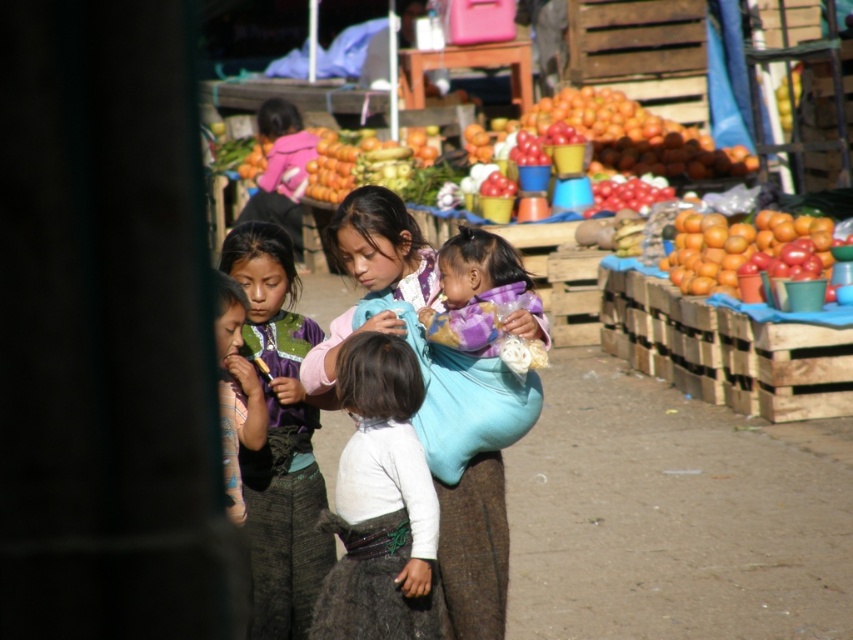
Question: Considering the real-world distances, which object is farthest from the purple fabric at center?

Choices:
 (A) matte purple fabric at center
 (B) white soft shirt at center
 (C) orange matte/orange at right

Answer: (C)

Question: Does white soft shirt at center have a greater width compared to orange matte/orange at right?

Choices:
 (A) yes
 (B) no

Answer: (B)

Question: Does matte purple fabric at center appear over purple fabric at center?

Choices:
 (A) no
 (B) yes

Answer: (B)

Question: Is matte purple fabric at center closer to the viewer compared to white soft shirt at center?

Choices:
 (A) no
 (B) yes

Answer: (A)

Question: Which object appears farthest from the camera in this image?

Choices:
 (A) purple fabric at center
 (B) orange matte/orange at right

Answer: (B)

Question: Estimate the real-world distances between objects in this image. Which object is closer to the white soft shirt at center?

Choices:
 (A) purple fabric at center
 (B) matte purple fabric at center

Answer: (B)